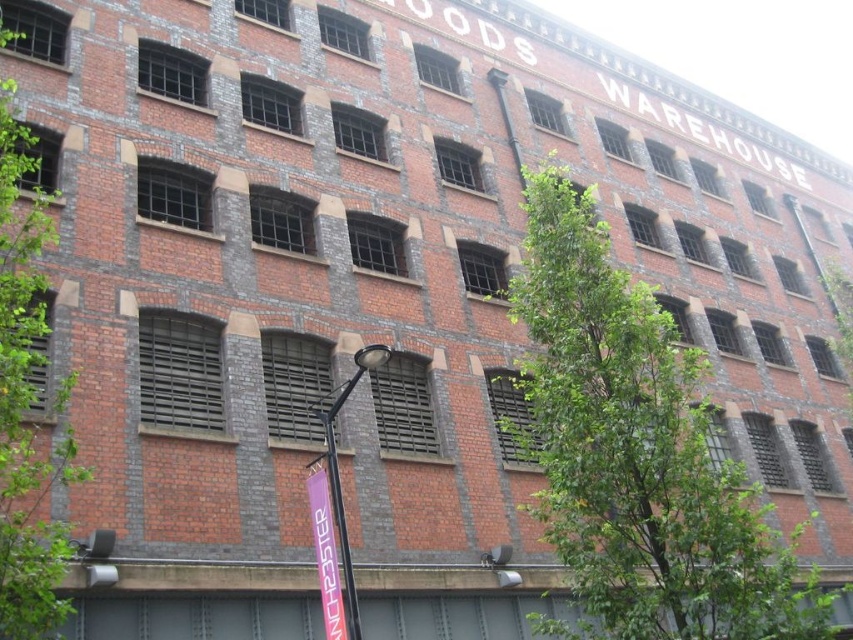
Question: Which point is closer to the camera?

Choices:
 (A) (346, 561)
 (B) (605, 515)
 (C) (49, 445)
 (D) (335, 588)

Answer: (D)

Question: Can you confirm if pink fabric banner at lower center is thinner than metallic signpost at center?

Choices:
 (A) no
 (B) yes

Answer: (A)

Question: Observing the image, what is the correct spatial positioning of green leafy tree at center in reference to black metal lamp post at center?

Choices:
 (A) above
 (B) below

Answer: (B)

Question: Which object is the closest to the black metal lamp post at center?

Choices:
 (A) green leafy tree at center
 (B) metallic signpost at center
 (C) green leafy tree at left

Answer: (B)

Question: Is green leafy tree at left smaller than black metal lamp post at center?

Choices:
 (A) yes
 (B) no

Answer: (B)

Question: Considering the real-world distances, which object is farthest from the green leafy tree at center?

Choices:
 (A) green leafy tree at left
 (B) metallic signpost at center

Answer: (A)